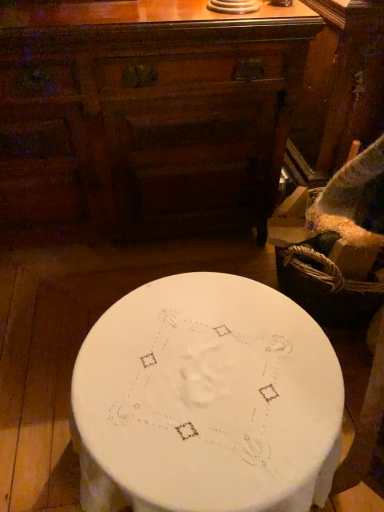
Question: Is matte brown chest of drawers at center inside or outside of white fabric-covered table at center?

Choices:
 (A) outside
 (B) inside

Answer: (A)

Question: Is point (188, 218) closer or farther from the camera than point (273, 355)?

Choices:
 (A) closer
 (B) farther

Answer: (B)

Question: From a real-world perspective, is matte brown chest of drawers at center positioned above or below white fabric-covered table at center?

Choices:
 (A) below
 (B) above

Answer: (B)

Question: From their relative heights in the image, would you say white fabric-covered table at center is taller or shorter than matte brown chest of drawers at center?

Choices:
 (A) tall
 (B) short

Answer: (B)

Question: In the image, is white fabric-covered table at center positioned in front of or behind matte brown chest of drawers at center?

Choices:
 (A) front
 (B) behind

Answer: (A)

Question: Would you say white fabric-covered table at center is to the left or to the right of matte brown chest of drawers at center in the picture?

Choices:
 (A) right
 (B) left

Answer: (A)

Question: From the image's perspective, is white fabric-covered table at center positioned above or below matte brown chest of drawers at center?

Choices:
 (A) above
 (B) below

Answer: (B)